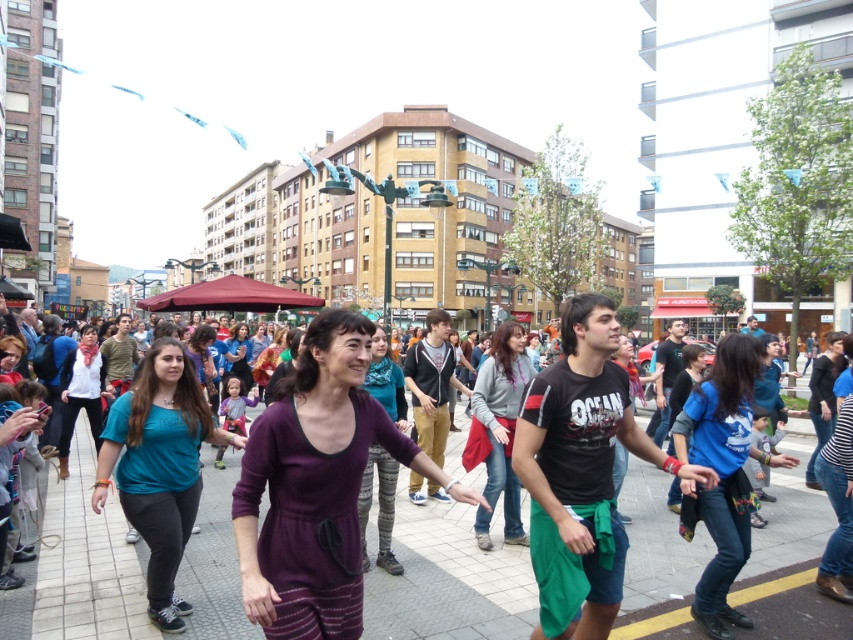
Question: Considering the real-world distances, which object is farthest from the dark blue jeans at center?

Choices:
 (A) white matte scarf at center
 (B) purple fabric crowd at center
 (C) teal fabric shirt at center
 (D) purple matte dress at center

Answer: (A)

Question: Where is purple fabric crowd at center located in relation to matte purple dress at center in the image?

Choices:
 (A) right
 (B) left

Answer: (A)

Question: Which object is positioned farthest from the denim jacket at center?

Choices:
 (A) purple matte dress at center
 (B) white matte scarf at center
 (C) matte purple dress at center

Answer: (C)

Question: Is purple knitwear at center further to camera compared to white matte scarf at center?

Choices:
 (A) yes
 (B) no

Answer: (B)

Question: Does blue denim jeans at center have a larger size compared to denim jacket at center?

Choices:
 (A) yes
 (B) no

Answer: (A)

Question: Which object is the farthest from the blue denim jeans at center?

Choices:
 (A) denim jacket at center
 (B) purple matte dress at center
 (C) purple knitwear at center

Answer: (C)